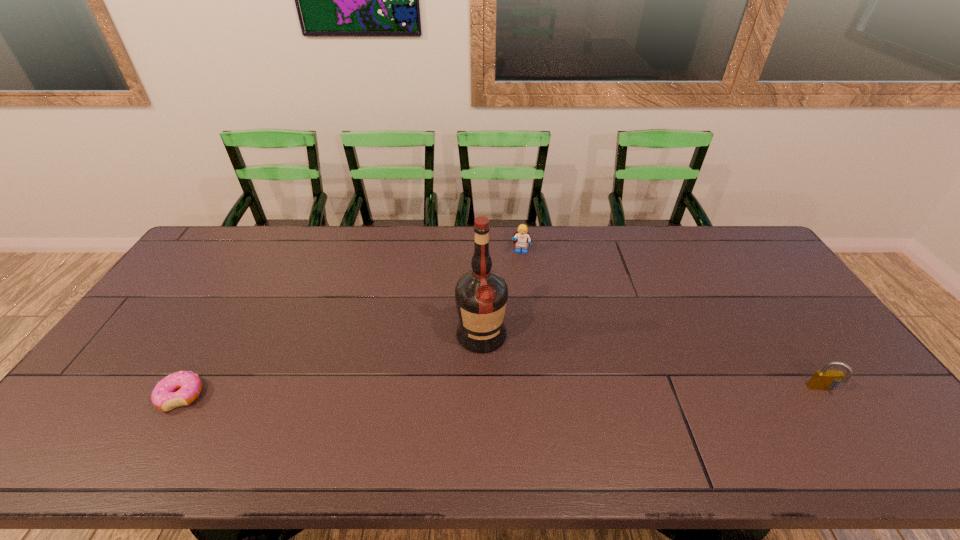
Locate an element on the screen. This screenshot has height=540, width=960. vacant area that lies between the padlock and the shortest object is located at coordinates (502, 393).

The width and height of the screenshot is (960, 540). In order to click on empty space that is in between the rightmost object and the second object from right to left in this screenshot , I will do `click(672, 321)`.

The height and width of the screenshot is (540, 960). In order to click on vacant space that is in between the second farthest object and the shortest object in this screenshot , I will do `click(331, 366)`.

I want to click on object that ranks as the closest to the padlock, so click(x=481, y=295).

At what (x,y) coordinates should I click in order to perform the action: click on object that is the third closest to the rightmost object. Please return your answer as a coordinate pair (x, y). Looking at the image, I should click on [x=182, y=388].

Image resolution: width=960 pixels, height=540 pixels. What are the coordinates of `vacant position in the image that satisfies the following two spatial constraints: 1. on the back side of the Lego; 2. on the left side of the second farthest object` in the screenshot? It's located at (481, 252).

Find the location of a particular element. The height and width of the screenshot is (540, 960). free space that satisfies the following two spatial constraints: 1. on the back side of the liquor; 2. on the right side of the leftmost object is located at coordinates coord(218,334).